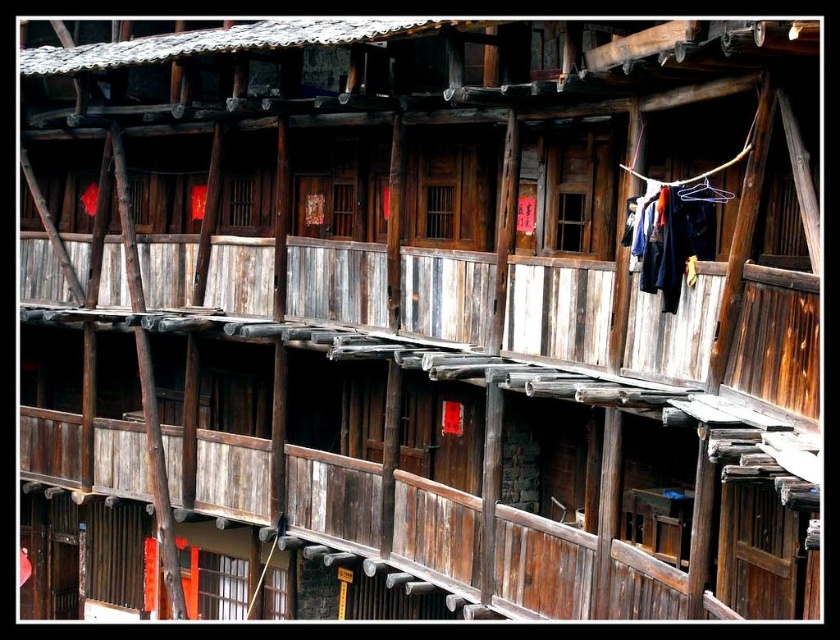
Between dark blue fabric at upper right and black fabric hanger at upper right, which one appears on the right side from the viewer's perspective?

From the viewer's perspective, black fabric hanger at upper right appears more on the right side.

Does point (659, 273) come in front of point (697, 188)?

No, (659, 273) is behind (697, 188).

The image size is (840, 640). Identify the location of dark blue fabric at upper right. (672, 236).